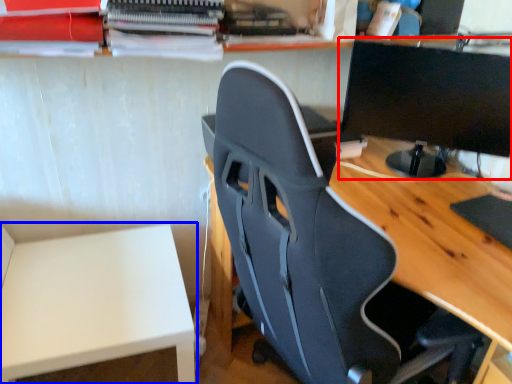
Question: Which point is closer to the camera, computer monitor (highlighted by a red box) or table (highlighted by a blue box)?

Choices:
 (A) computer monitor
 (B) table

Answer: (B)